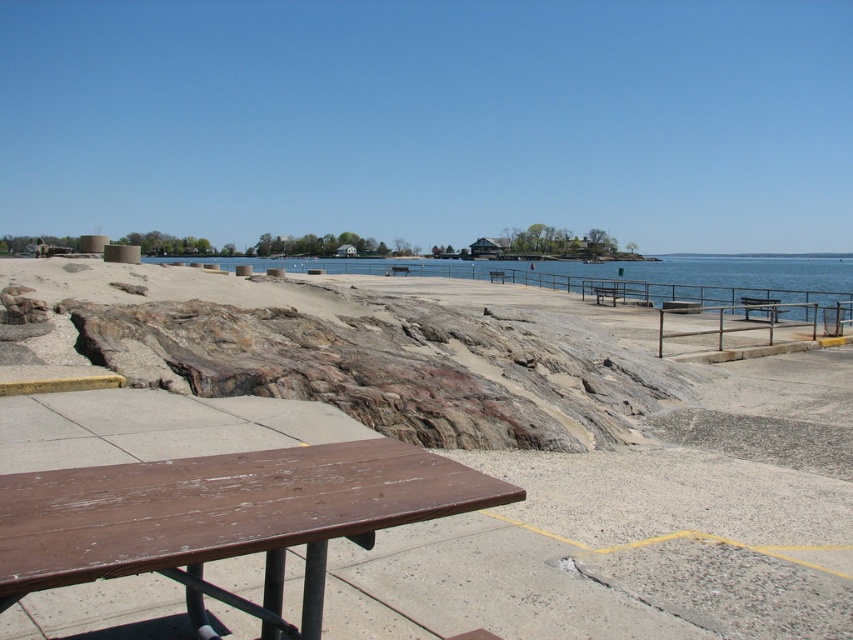
Question: Does wooden picnic table at lower left appear under blue water at center?

Choices:
 (A) yes
 (B) no

Answer: (A)

Question: Which object is closer to the camera taking this photo?

Choices:
 (A) wooden picnic table at lower left
 (B) brown wooden bench at center

Answer: (A)

Question: Based on their relative distances, which object is nearer to the wooden picnic table at lower left?

Choices:
 (A) blue water at center
 (B) brown wooden bench at center

Answer: (A)

Question: Which point is farther to the camera?

Choices:
 (A) wooden picnic table at lower left
 (B) brown wooden bench at center

Answer: (B)

Question: Can you confirm if blue water at center is positioned to the right of brown wooden bench at center?

Choices:
 (A) no
 (B) yes

Answer: (B)

Question: Can you confirm if wooden picnic table at lower left is thinner than brown wooden bench at center?

Choices:
 (A) no
 (B) yes

Answer: (A)